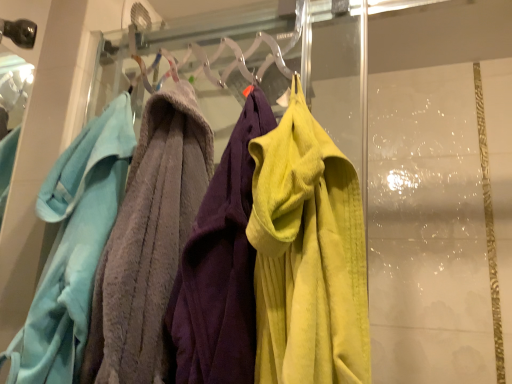
Question: Should I look upward or downward to see soft gray towel at left, which ranks as the 2th towel in right-to-left order?

Choices:
 (A) down
 (B) up

Answer: (A)

Question: Which direction should I rotate to look at soft yellow towel at center, which is counted as the first towel, starting from the right, — up or down?

Choices:
 (A) down
 (B) up

Answer: (A)

Question: Does soft yellow towel at center, which is counted as the first towel, starting from the right, have a lesser width compared to soft gray towel at left, which ranks as the 2th towel in right-to-left order?

Choices:
 (A) yes
 (B) no

Answer: (B)

Question: Considering the relative sizes of soft yellow towel at center, which is counted as the first towel, starting from the right, and soft gray towel at left, the first towel in the left-to-right sequence, in the image provided, is soft yellow towel at center, which is counted as the first towel, starting from the right, wider than soft gray towel at left, the first towel in the left-to-right sequence,?

Choices:
 (A) no
 (B) yes

Answer: (B)

Question: From the image's perspective, is soft yellow towel at center, which is counted as the first towel, starting from the right, under soft gray towel at left, which ranks as the 2th towel in right-to-left order?

Choices:
 (A) no
 (B) yes

Answer: (A)

Question: Is soft yellow towel at center, which is counted as the first towel, starting from the right, to the right of soft gray towel at left, which ranks as the 2th towel in right-to-left order, from the viewer's perspective?

Choices:
 (A) no
 (B) yes

Answer: (B)

Question: Does soft yellow towel at center, which is counted as the first towel, starting from the right, have a lesser height compared to soft gray towel at left, the first towel in the left-to-right sequence?

Choices:
 (A) yes
 (B) no

Answer: (A)

Question: Is the depth of soft yellow towel at center, the second towel positioned from the left, greater than that of soft gray towel at left, which ranks as the 2th towel in right-to-left order?

Choices:
 (A) no
 (B) yes

Answer: (A)

Question: Is soft gray towel at left, the first towel in the left-to-right sequence, completely or partially outside of soft yellow towel at center, the second towel positioned from the left?

Choices:
 (A) no
 (B) yes

Answer: (B)

Question: From a real-world perspective, is soft gray towel at left, which ranks as the 2th towel in right-to-left order, over soft yellow towel at center, which is counted as the first towel, starting from the right?

Choices:
 (A) yes
 (B) no

Answer: (B)

Question: Would you say soft gray towel at left, the first towel in the left-to-right sequence, contains soft yellow towel at center, the second towel positioned from the left?

Choices:
 (A) no
 (B) yes

Answer: (A)

Question: Is soft gray towel at left, the first towel in the left-to-right sequence, beside soft yellow towel at center, which is counted as the first towel, starting from the right?

Choices:
 (A) no
 (B) yes

Answer: (A)

Question: Does soft gray towel at left, the first towel in the left-to-right sequence, lie behind soft yellow towel at center, the second towel positioned from the left?

Choices:
 (A) yes
 (B) no

Answer: (A)

Question: Does soft gray towel at left, the first towel in the left-to-right sequence, have a larger size compared to soft yellow towel at center, which is counted as the first towel, starting from the right?

Choices:
 (A) yes
 (B) no

Answer: (B)

Question: From a real-world perspective, is soft yellow towel at center, the second towel positioned from the left, above or below soft gray towel at left, the first towel in the left-to-right sequence?

Choices:
 (A) below
 (B) above

Answer: (B)